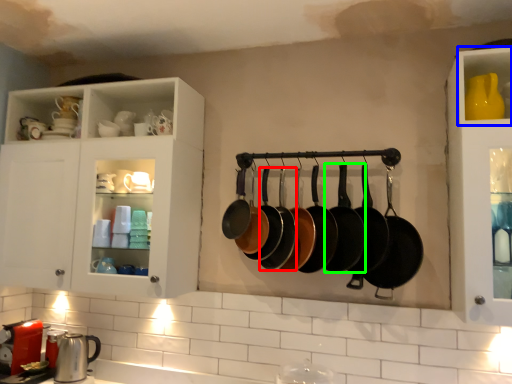
Question: Based on their relative distances, which object is nearer to frying pan (highlighted by a red box)? Choose from cabinet (highlighted by a blue box) and frying pan (highlighted by a green box).

Choices:
 (A) cabinet
 (B) frying pan

Answer: (B)